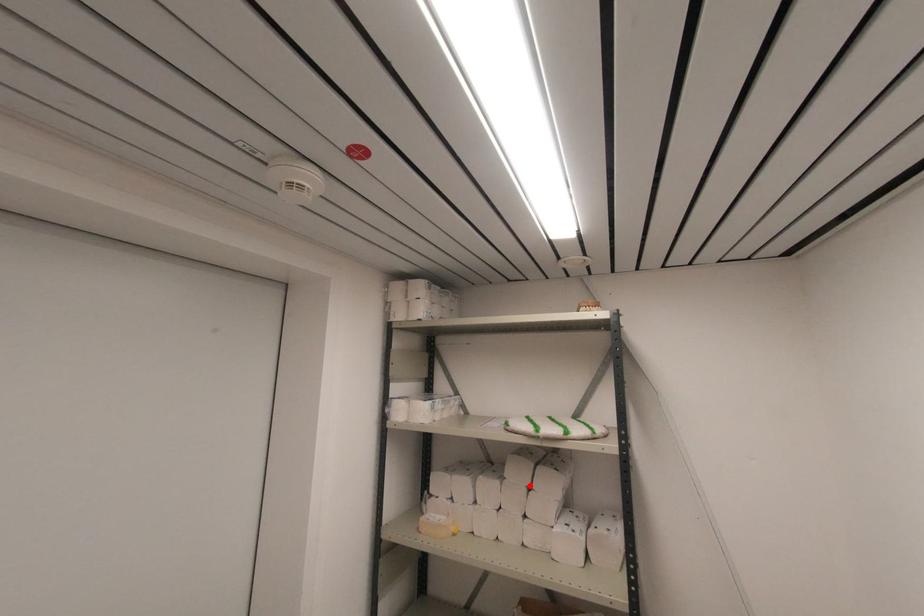
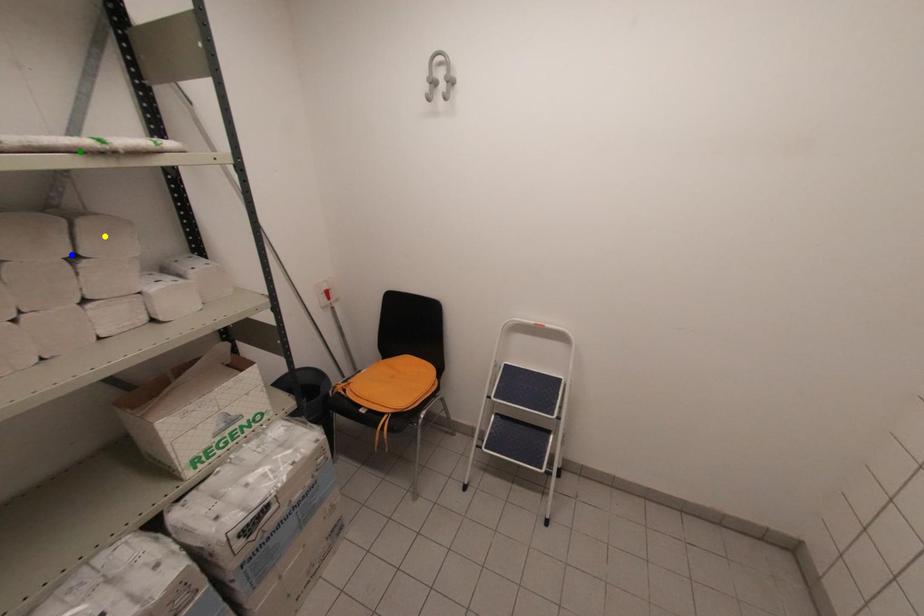
Question: I am providing you with two images of the same scene from different viewpoints. A red point is marked on the first image. You are given multiple points on the second image. Which spot in image 2 lines up with the point in image 1?

Choices:
 (A) yellow point
 (B) green point
 (C) blue point

Answer: (C)